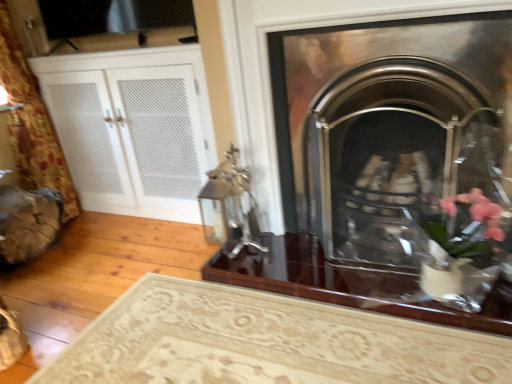
Question: Should I look upward or downward to see white mesh cabinet at left?

Choices:
 (A) down
 (B) up

Answer: (B)

Question: Considering the relative positions of polished chrome fireplace at center, positioned as the second fireplace in bottom-to-top order, and glossy dark wood table at center in the image provided, is polished chrome fireplace at center, positioned as the second fireplace in bottom-to-top order, behind glossy dark wood table at center?

Choices:
 (A) yes
 (B) no

Answer: (B)

Question: Is polished chrome fireplace at center, positioned as the second fireplace in bottom-to-top order, smaller than glossy dark wood table at center?

Choices:
 (A) yes
 (B) no

Answer: (B)

Question: Does polished chrome fireplace at center, arranged as the 1th fireplace when viewed from the top, touch glossy dark wood table at center?

Choices:
 (A) no
 (B) yes

Answer: (A)

Question: Is polished chrome fireplace at center, positioned as the second fireplace in bottom-to-top order, closer to camera compared to glossy dark wood table at center?

Choices:
 (A) no
 (B) yes

Answer: (B)

Question: From a real-world perspective, is polished chrome fireplace at center, positioned as the second fireplace in bottom-to-top order, positioned over glossy dark wood table at center based on gravity?

Choices:
 (A) no
 (B) yes

Answer: (B)

Question: Can glossy dark wood table at center be found inside polished chrome fireplace at center, arranged as the 1th fireplace when viewed from the top?

Choices:
 (A) no
 (B) yes

Answer: (A)

Question: Does polished chrome fireplace at center, arranged as the 1th fireplace when viewed from the top, have a lesser width compared to polished metal fireplace at center, which appears as the second fireplace when viewed from the top?

Choices:
 (A) yes
 (B) no

Answer: (A)

Question: Is polished chrome fireplace at center, arranged as the 1th fireplace when viewed from the top, shorter than polished metal fireplace at center, arranged as the 1th fireplace when ordered from the bottom?

Choices:
 (A) no
 (B) yes

Answer: (A)

Question: From a real-world perspective, is polished chrome fireplace at center, arranged as the 1th fireplace when viewed from the top, located beneath polished metal fireplace at center, arranged as the 1th fireplace when ordered from the bottom?

Choices:
 (A) no
 (B) yes

Answer: (A)

Question: Is polished metal fireplace at center, arranged as the 1th fireplace when ordered from the bottom, completely or partially inside polished chrome fireplace at center, arranged as the 1th fireplace when viewed from the top?

Choices:
 (A) no
 (B) yes

Answer: (B)

Question: Considering the relative sizes of polished chrome fireplace at center, positioned as the second fireplace in bottom-to-top order, and polished metal fireplace at center, which appears as the second fireplace when viewed from the top, in the image provided, is polished chrome fireplace at center, positioned as the second fireplace in bottom-to-top order, wider than polished metal fireplace at center, which appears as the second fireplace when viewed from the top,?

Choices:
 (A) no
 (B) yes

Answer: (A)

Question: Is polished chrome fireplace at center, arranged as the 1th fireplace when viewed from the top, beside polished metal fireplace at center, arranged as the 1th fireplace when ordered from the bottom?

Choices:
 (A) yes
 (B) no

Answer: (A)

Question: Considering the relative sizes of white mesh cabinet at left and polished chrome fireplace at center, arranged as the 1th fireplace when viewed from the top, in the image provided, is white mesh cabinet at left smaller than polished chrome fireplace at center, arranged as the 1th fireplace when viewed from the top,?

Choices:
 (A) no
 (B) yes

Answer: (A)